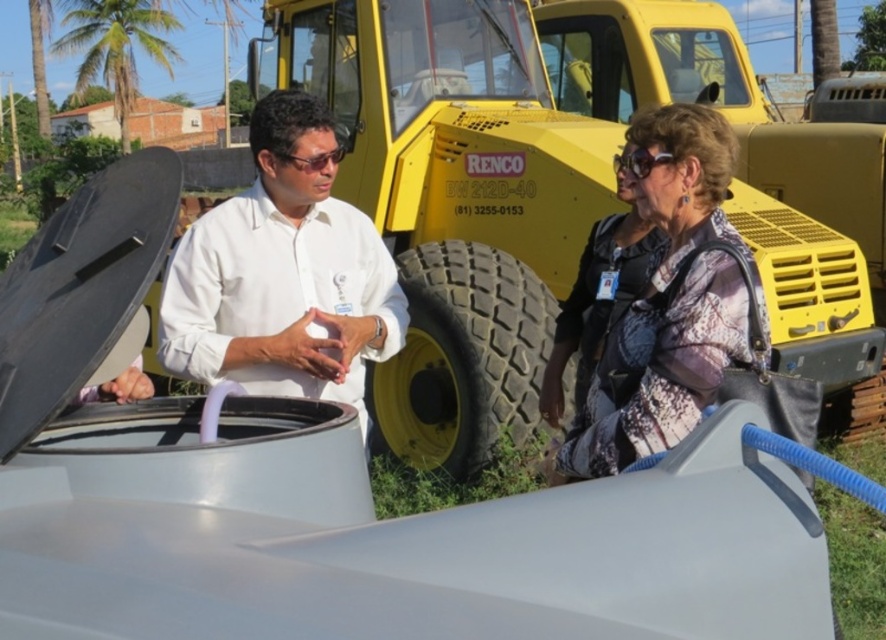
Question: Which point appears farthest from the camera in this image?

Choices:
 (A) click(305, 298)
 (B) click(692, 381)
 (C) click(620, 156)
 (D) click(436, 314)

Answer: (D)

Question: Among these objects, which one is farthest from the camera?

Choices:
 (A) black rubber tire at center
 (B) white matte shirt at center
 (C) patterned fabric dress at center

Answer: (A)

Question: Is patterned fabric dress at center in front of black rubber tire at center?

Choices:
 (A) no
 (B) yes

Answer: (B)

Question: Is patterned fabric dress at center closer to the viewer compared to sunglasses at upper right?

Choices:
 (A) yes
 (B) no

Answer: (A)

Question: In this image, where is white matte shirt at center located relative to patterned fabric dress at center?

Choices:
 (A) left
 (B) right

Answer: (A)

Question: Which object appears farthest from the camera in this image?

Choices:
 (A) black rubber tire at center
 (B) white matte shirt at center

Answer: (A)